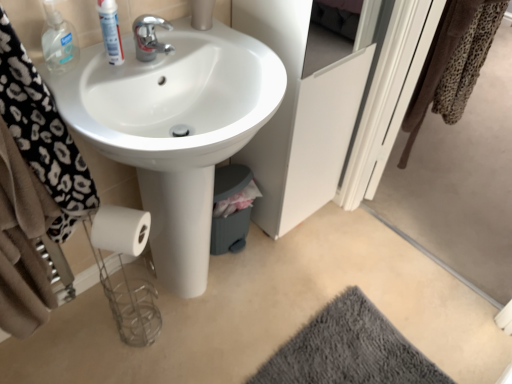
Identify the location of free spot to the left of gray fuzzy rug at lower right. (226, 326).